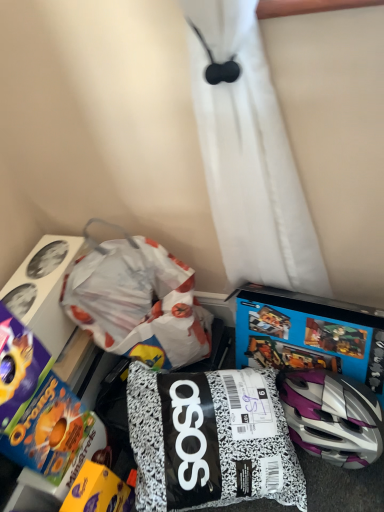
Question: From a real-world perspective, is white paper bag at center below black and white speckled bag at center, which is the 1th toy in right-to-left order?

Choices:
 (A) no
 (B) yes

Answer: (A)

Question: Considering the relative sizes of white paper bag at center and black and white speckled bag at center, which is counted as the 3th toy, starting from the left, in the image provided, is white paper bag at center taller than black and white speckled bag at center, which is counted as the 3th toy, starting from the left,?

Choices:
 (A) no
 (B) yes

Answer: (A)

Question: Considering the relative sizes of white paper bag at center and black and white speckled bag at center, which is counted as the 3th toy, starting from the left, in the image provided, is white paper bag at center shorter than black and white speckled bag at center, which is counted as the 3th toy, starting from the left,?

Choices:
 (A) no
 (B) yes

Answer: (B)

Question: Can you confirm if white paper bag at center is thinner than black and white speckled bag at center, which is counted as the 3th toy, starting from the left?

Choices:
 (A) yes
 (B) no

Answer: (A)

Question: Is white paper bag at center next to black and white speckled bag at center, which is the 1th toy in right-to-left order, and touching it?

Choices:
 (A) yes
 (B) no

Answer: (B)

Question: Is white paper bag at center at the right side of black and white speckled bag at center, which is the 1th toy in right-to-left order?

Choices:
 (A) yes
 (B) no

Answer: (B)

Question: Does blue cardboard video game at lower right have a greater height compared to black and white speckled bag at center, which is counted as the 3th toy, starting from the left?

Choices:
 (A) no
 (B) yes

Answer: (A)

Question: Is blue cardboard video game at lower right smaller than black and white speckled bag at center, which is the 1th toy in right-to-left order?

Choices:
 (A) yes
 (B) no

Answer: (A)

Question: Is blue cardboard video game at lower right at the left side of black and white speckled bag at center, which is the 1th toy in right-to-left order?

Choices:
 (A) no
 (B) yes

Answer: (A)

Question: Does blue cardboard video game at lower right come in front of black and white speckled bag at center, which is the 1th toy in right-to-left order?

Choices:
 (A) no
 (B) yes

Answer: (A)

Question: From the image's perspective, is blue cardboard video game at lower right on black and white speckled bag at center, which is the 1th toy in right-to-left order?

Choices:
 (A) yes
 (B) no

Answer: (A)

Question: From a real-world perspective, does blue cardboard video game at lower right stand above black and white speckled bag at center, which is the 1th toy in right-to-left order?

Choices:
 (A) no
 (B) yes

Answer: (A)

Question: Is white paper bag at center bigger than blue cardboard cereal box at lower left, positioned as the third toy in right-to-left order?

Choices:
 (A) yes
 (B) no

Answer: (A)